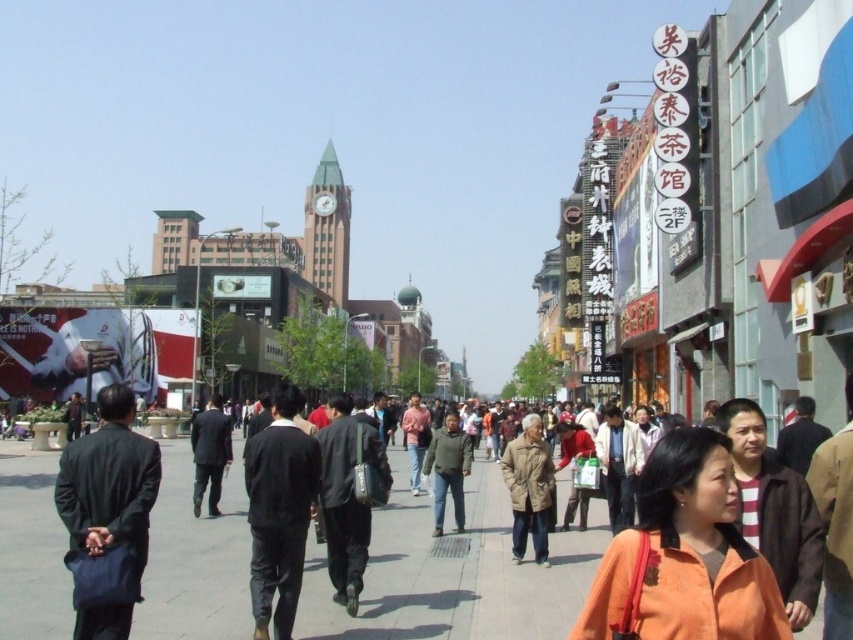
Which of these two, dark gray jacket at center or dark gray suit at center, stands taller?

Standing taller between the two is dark gray jacket at center.

Can you confirm if dark gray jacket at center is taller than dark gray suit at center?

Yes.

The width and height of the screenshot is (853, 640). What do you see at coordinates (448, 468) in the screenshot? I see `dark gray jacket at center` at bounding box center [448, 468].

The height and width of the screenshot is (640, 853). What are the coordinates of `dark gray jacket at center` in the screenshot? It's located at (448, 468).

Does dark gray suit at left appear on the right side of dark gray jacket at center?

In fact, dark gray suit at left is to the left of dark gray jacket at center.

Which of these two, dark gray suit at left or dark gray jacket at center, stands shorter?

Standing shorter between the two is dark gray jacket at center.

Identify the location of dark gray suit at left. (109, 480).

Does tan fabric coat at center have a larger size compared to dark gray suit at center?

No, tan fabric coat at center is not bigger than dark gray suit at center.

Who is shorter, tan fabric coat at center or dark gray suit at center?

With less height is dark gray suit at center.

Between point (525, 484) and point (212, 417), which one is positioned behind?

Positioned behind is point (212, 417).

Locate an element on the screen. tan fabric coat at center is located at coordinates (529, 488).